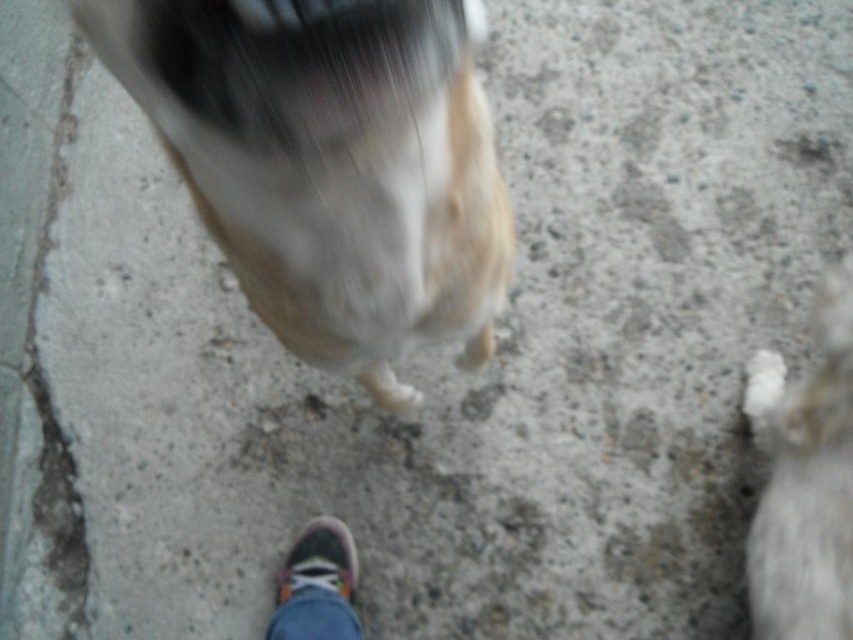
Question: Is fluffy white dog at center bigger than white fluffy dog at lower right?

Choices:
 (A) no
 (B) yes

Answer: (A)

Question: Which object is farther from the camera taking this photo?

Choices:
 (A) white fluffy dog at lower right
 (B) multicolored canvas shoe at lower center
 (C) fluffy white dog at center

Answer: (B)

Question: Which of the following is the closest to the observer?

Choices:
 (A) (235, 52)
 (B) (782, 394)

Answer: (A)

Question: Which point appears closest to the camera in this image?

Choices:
 (A) (274, 612)
 (B) (360, 188)

Answer: (B)

Question: Does fluffy white dog at center appear on the right side of white fluffy dog at lower right?

Choices:
 (A) no
 (B) yes

Answer: (A)

Question: Is fluffy white dog at center bigger than white fluffy dog at lower right?

Choices:
 (A) no
 (B) yes

Answer: (A)